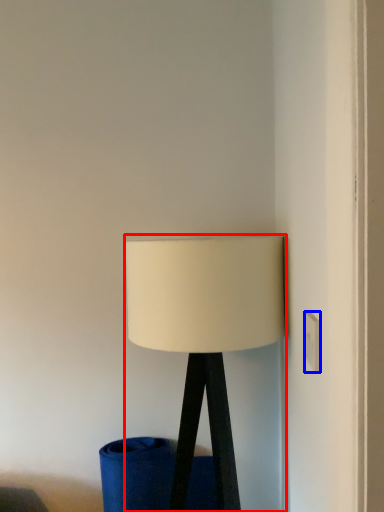
Question: Which point is closer to the camera, lamp (highlighted by a red box) or electric outlet (highlighted by a blue box)?

Choices:
 (A) lamp
 (B) electric outlet

Answer: (B)